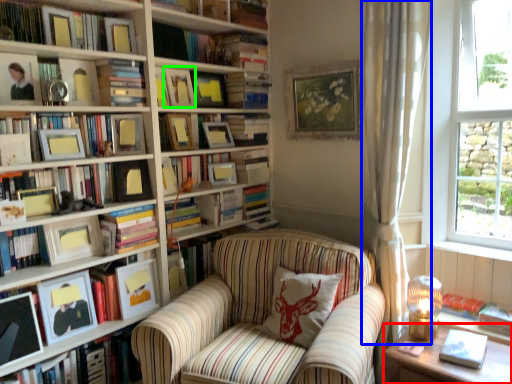
Question: Based on their relative distances, which object is nearer to table (highlighted by a red box)? Choose from curtain (highlighted by a blue box) and picture frame (highlighted by a green box).

Choices:
 (A) curtain
 (B) picture frame

Answer: (A)